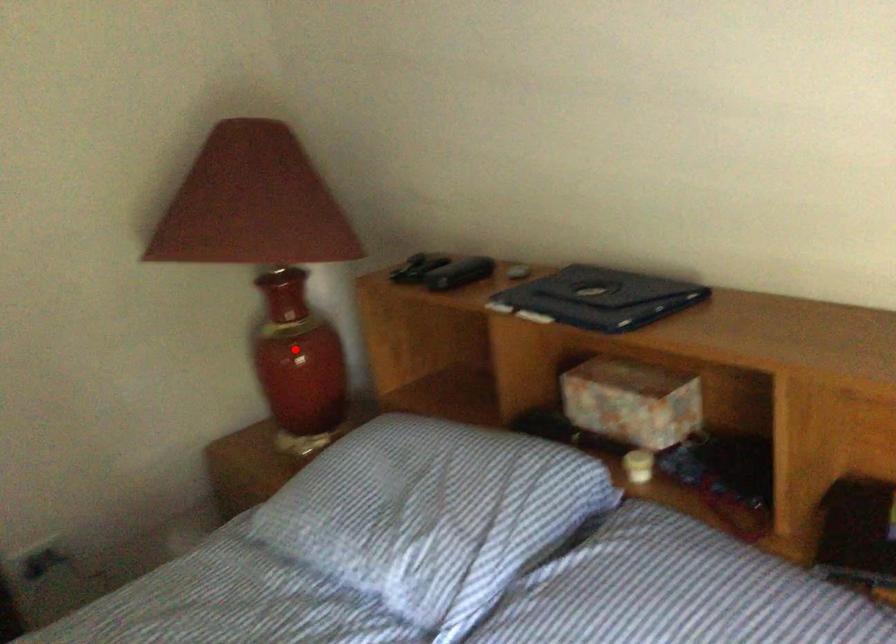
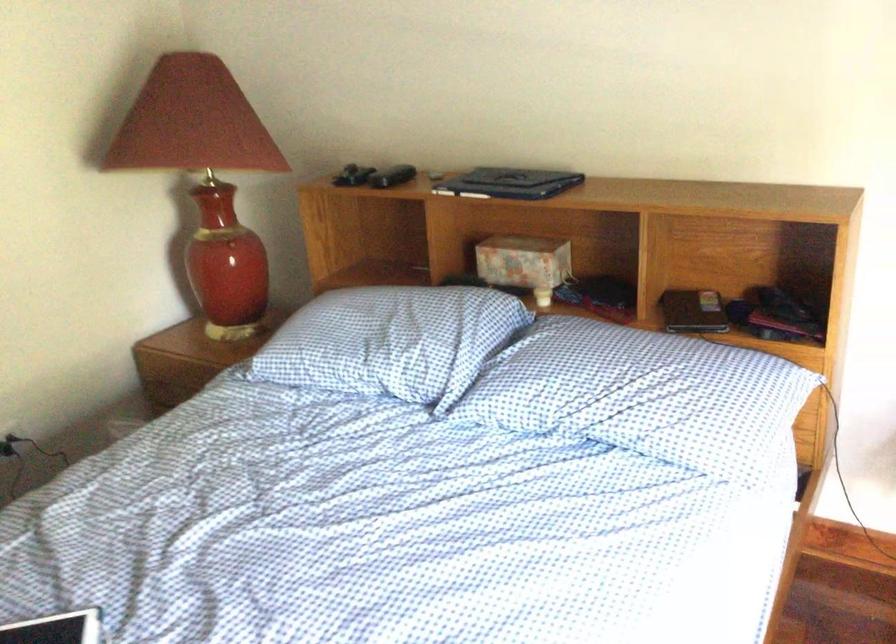
The point at the highlighted location is marked in the first image. Where is the corresponding point in the second image?

(229, 249)